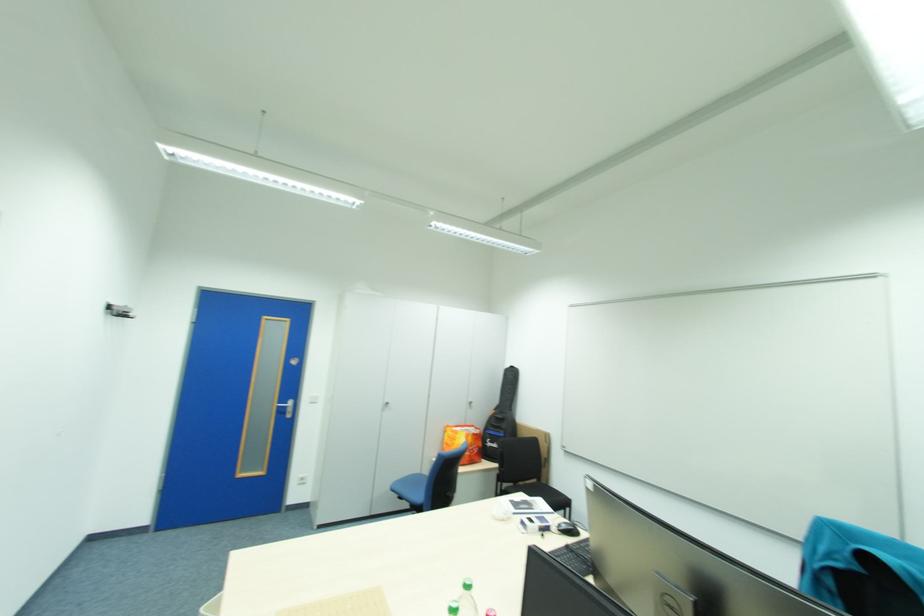
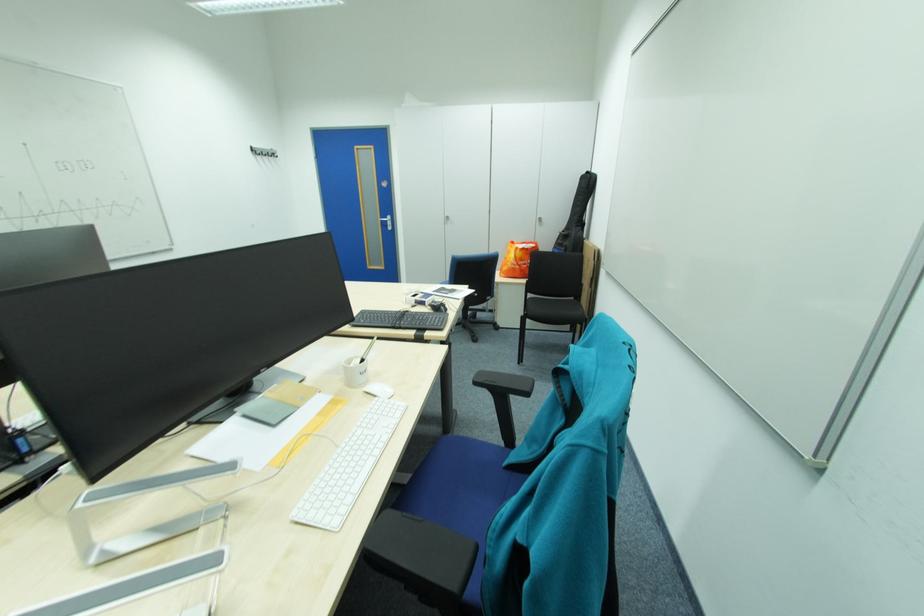
Question: I am providing you with two images of the same scene from different viewpoints. After the viewpoint changes to image2, which objects are now occluded?

Choices:
 (A) white computer mouse
 (B) yellow mango
 (C) pink plastic bottle
 (D) white pen cup

Answer: (C)